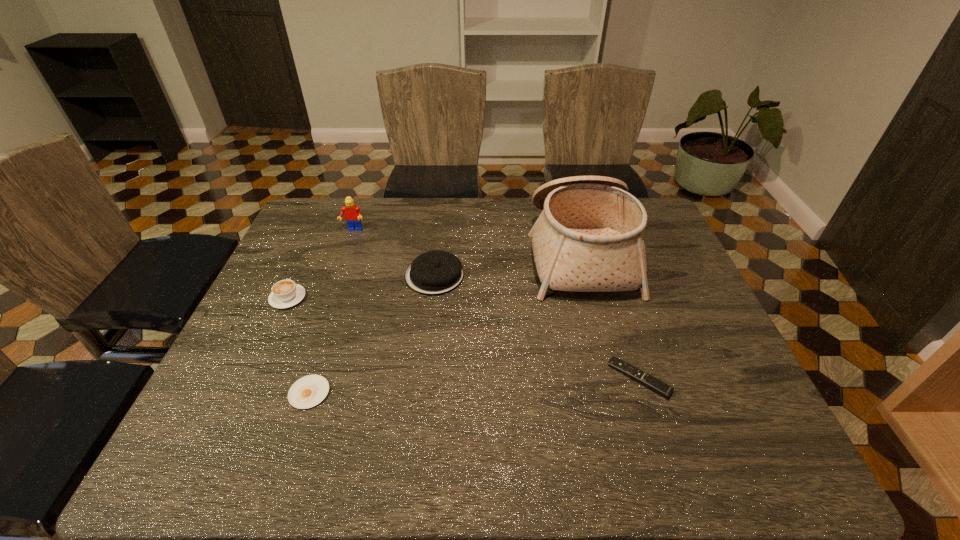
Identify the location of free location located with the lid open on the basket. (491, 252).

Image resolution: width=960 pixels, height=540 pixels. I want to click on vacant space located on the front-facing side of the Lego, so click(341, 266).

Locate an element on the screen. vacant space situated on the left of the pancake is located at coordinates (388, 275).

The height and width of the screenshot is (540, 960). Find the location of `vacant region located on the side of the third shortest object with the handle`. vacant region located on the side of the third shortest object with the handle is located at coordinates (308, 253).

The width and height of the screenshot is (960, 540). I want to click on free space located 0.070m on the side of the third shortest object with the handle, so click(x=300, y=269).

Where is `free spot located on the side of the third shortest object with the handle`? This screenshot has width=960, height=540. free spot located on the side of the third shortest object with the handle is located at coordinates coord(324,221).

In order to click on vacant space located 0.270m on the left of the remote control in this screenshot , I will do `click(493, 378)`.

You are a GUI agent. You are given a task and a screenshot of the screen. Output one action in this format:
    pyautogui.click(x=<x>, y=<y>)
    Task: Click on the vacant space located on the front of the egg yolk
    The width and height of the screenshot is (960, 540).
    Given the screenshot: What is the action you would take?
    pyautogui.click(x=297, y=432)

Locate an element on the screen. basket present at the far edge is located at coordinates (589, 237).

Identify the location of Lego that is at the far edge. (352, 212).